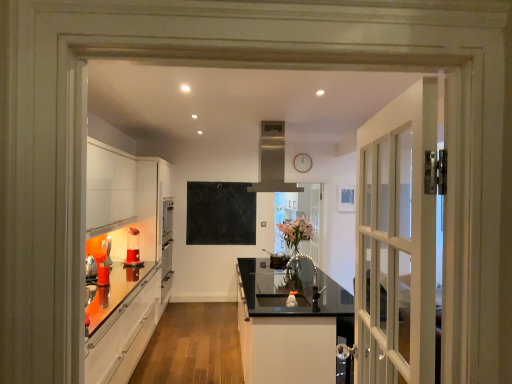
Question: Can metallic silver faucet at center, which ranks as the first appliance in right-to-left order, be found inside glossy black countertop at center?

Choices:
 (A) yes
 (B) no

Answer: (B)

Question: Is glossy black countertop at center in front of metallic silver faucet at center, positioned as the 3th appliance in back-to-front order?

Choices:
 (A) yes
 (B) no

Answer: (A)

Question: Is glossy black countertop at center thinner than metallic silver faucet at center, which ranks as the first appliance in right-to-left order?

Choices:
 (A) yes
 (B) no

Answer: (B)

Question: From a real-world perspective, is glossy black countertop at center located beneath metallic silver faucet at center, the first appliance viewed from the front?

Choices:
 (A) no
 (B) yes

Answer: (B)

Question: From a real-world perspective, is glossy black countertop at center located higher than metallic silver faucet at center, which ranks as the first appliance in right-to-left order?

Choices:
 (A) yes
 (B) no

Answer: (B)

Question: Is translucent plastic blender at lower left, the second appliance viewed from the right, to the left or to the right of brushed metal kettle at left, acting as the 3th appliance starting from the right, in the image?

Choices:
 (A) left
 (B) right

Answer: (B)

Question: In the image, is translucent plastic blender at lower left, the second appliance viewed from the right, positioned in front of or behind brushed metal kettle at left, which appears as the 2th appliance when viewed from the back?

Choices:
 (A) front
 (B) behind

Answer: (B)

Question: From a real-world perspective, relative to brushed metal kettle at left, acting as the 3th appliance starting from the right, is translucent plastic blender at lower left, acting as the 1th appliance starting from the back, vertically above or below?

Choices:
 (A) above
 (B) below

Answer: (A)

Question: From the image's perspective, is translucent plastic blender at lower left, acting as the 3th appliance starting from the front, located above or below brushed metal kettle at left, which appears as the 2th appliance when viewed from the back?

Choices:
 (A) above
 (B) below

Answer: (A)

Question: Looking at the image, does satin silver exhaust hood at upper center seem bigger or smaller compared to brushed metal kettle at left, which appears as the 2th appliance when viewed from the back?

Choices:
 (A) small
 (B) big

Answer: (B)

Question: From a real-world perspective, is satin silver exhaust hood at upper center above or below brushed metal kettle at left, placed as the first appliance when sorted from left to right?

Choices:
 (A) below
 (B) above

Answer: (B)

Question: Is satin silver exhaust hood at upper center wider or thinner than brushed metal kettle at left, which is counted as the 2th appliance, starting from the front?

Choices:
 (A) wide
 (B) thin

Answer: (A)

Question: Is point click(x=264, y=122) closer or farther from the camera than point click(x=111, y=246)?

Choices:
 (A) closer
 (B) farther

Answer: (B)

Question: Visually, is clear glass door at center positioned to the left or to the right of black matte chalkboard at center?

Choices:
 (A) left
 (B) right

Answer: (B)

Question: From the image's perspective, is clear glass door at center above or below black matte chalkboard at center?

Choices:
 (A) below
 (B) above

Answer: (A)